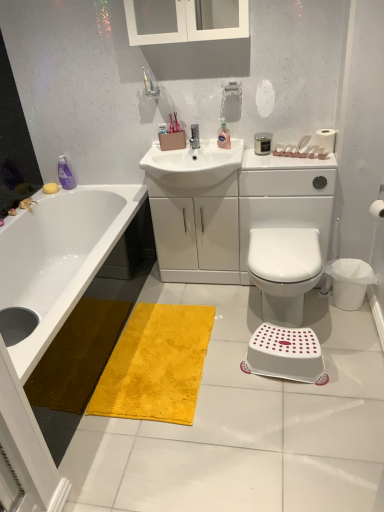
Question: Is white paper at upper right, acting as the 2th toilet paper starting from the right, smaller than white matte toilet paper at right, which is counted as the 1th toilet paper, starting from the bottom?

Choices:
 (A) yes
 (B) no

Answer: (B)

Question: Is white paper at upper right, which is counted as the second toilet paper, starting from the front, bigger than white matte toilet paper at right, the second toilet paper viewed from the top?

Choices:
 (A) yes
 (B) no

Answer: (A)

Question: Is white paper at upper right, placed as the 1th toilet paper when sorted from back to front, positioned behind white matte toilet paper at right, the 1th toilet paper from the right?

Choices:
 (A) no
 (B) yes

Answer: (B)

Question: Is white paper at upper right, placed as the 1th toilet paper when sorted from back to front, oriented away from white matte toilet paper at right, the 1th toilet paper from the right?

Choices:
 (A) yes
 (B) no

Answer: (B)

Question: From the image's perspective, is white paper at upper right, the 1th toilet paper viewed from the top, on white matte toilet paper at right, arranged as the first toilet paper when viewed from the front?

Choices:
 (A) no
 (B) yes

Answer: (B)

Question: Would you say translucent plastic soap dispenser at upper center, acting as the 2th toiletry starting from the left, is inside or outside yellow plush rug at center?

Choices:
 (A) inside
 (B) outside

Answer: (B)

Question: Looking at their shapes, would you say translucent plastic soap dispenser at upper center, acting as the 2th toiletry starting from the left, is wider or thinner than yellow plush rug at center?

Choices:
 (A) wide
 (B) thin

Answer: (B)

Question: Considering their positions, is translucent plastic soap dispenser at upper center, arranged as the 2th toiletry when viewed from the front, located in front of or behind yellow plush rug at center?

Choices:
 (A) front
 (B) behind

Answer: (B)

Question: From a real-world perspective, relative to yellow plush rug at center, is translucent plastic soap dispenser at upper center, arranged as the 2th toiletry when viewed from the front, vertically above or below?

Choices:
 (A) below
 (B) above

Answer: (B)

Question: From a real-world perspective, is white plastic step stool at lower center above or below white glossy sink at center?

Choices:
 (A) above
 (B) below

Answer: (B)

Question: From the image's perspective, is white plastic step stool at lower center located above or below white glossy sink at center?

Choices:
 (A) below
 (B) above

Answer: (A)

Question: In the image, is white plastic step stool at lower center positioned in front of or behind white glossy sink at center?

Choices:
 (A) front
 (B) behind

Answer: (A)

Question: From their relative heights in the image, would you say white plastic step stool at lower center is taller or shorter than white glossy sink at center?

Choices:
 (A) tall
 (B) short

Answer: (B)

Question: Considering the relative positions of translucent plastic soap dispenser at upper center, the second toiletry in the back-to-front sequence, and white glass medicine cabinet at upper center in the image provided, is translucent plastic soap dispenser at upper center, the second toiletry in the back-to-front sequence, to the left or to the right of white glass medicine cabinet at upper center?

Choices:
 (A) left
 (B) right

Answer: (B)

Question: Considering the positions of point (218, 137) and point (240, 33), is point (218, 137) closer or farther from the camera than point (240, 33)?

Choices:
 (A) farther
 (B) closer

Answer: (A)